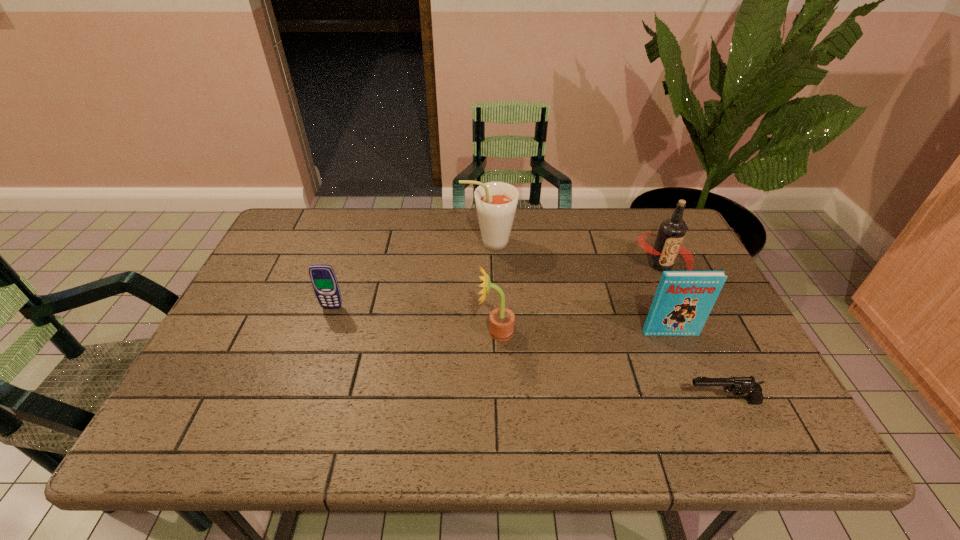
Where is `the left root beer`? The height and width of the screenshot is (540, 960). the left root beer is located at coordinates (496, 202).

Image resolution: width=960 pixels, height=540 pixels. Identify the location of the right root beer. (668, 243).

Where is `sunflower`? Image resolution: width=960 pixels, height=540 pixels. sunflower is located at coordinates (501, 323).

The width and height of the screenshot is (960, 540). In order to click on book in this screenshot , I will do `click(683, 300)`.

Where is `the fourth nearest object`? The image size is (960, 540). the fourth nearest object is located at coordinates (323, 278).

You are a GUI agent. You are given a task and a screenshot of the screen. Output one action in this format:
    pyautogui.click(x=<x>, y=<y>)
    Task: Click on the cellular telephone
    The height and width of the screenshot is (540, 960).
    Given the screenshot: What is the action you would take?
    pyautogui.click(x=323, y=278)

The width and height of the screenshot is (960, 540). Find the location of `the nearest object`. the nearest object is located at coordinates (737, 385).

Image resolution: width=960 pixels, height=540 pixels. I want to click on gun, so click(x=737, y=385).

The height and width of the screenshot is (540, 960). I want to click on free space located on the drink side of the left root beer, so click(361, 243).

The height and width of the screenshot is (540, 960). Find the location of `vacant space situated 0.230m on the drink side of the left root beer`. vacant space situated 0.230m on the drink side of the left root beer is located at coordinates (387, 243).